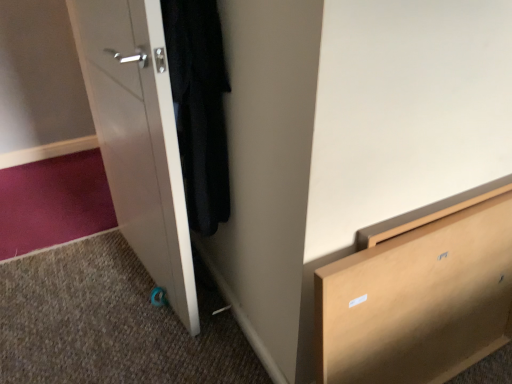
Locate an element on the screen. Image resolution: width=512 pixels, height=384 pixels. vacant location below white glossy door at left (from a real-world perspective) is located at coordinates (148, 294).